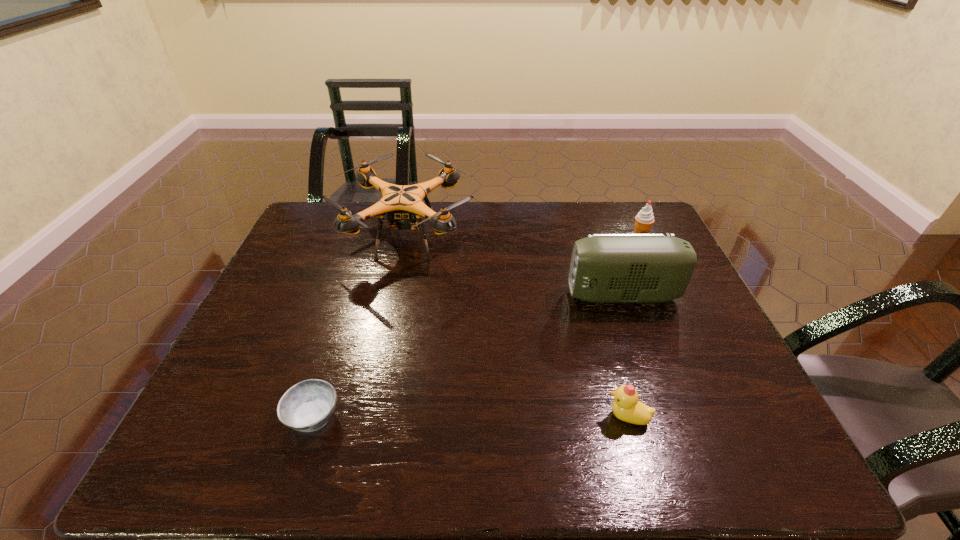
The height and width of the screenshot is (540, 960). I want to click on vacant region that satisfies the following two spatial constraints: 1. on the camera mount of the drone; 2. on the front side of the ashtray, so click(370, 416).

The image size is (960, 540). In order to click on vacant space that satisfies the following two spatial constraints: 1. on the front side of the icecream; 2. on the front-facing side of the radio_receiver in this screenshot , I will do `click(666, 295)`.

You are a GUI agent. You are given a task and a screenshot of the screen. Output one action in this format:
    pyautogui.click(x=<x>, y=<y>)
    Task: Click on the vacant space that satisfies the following two spatial constraints: 1. on the front-facing side of the radio_receiver; 2. on the front side of the ashtray
    The image size is (960, 540).
    Given the screenshot: What is the action you would take?
    pyautogui.click(x=664, y=416)